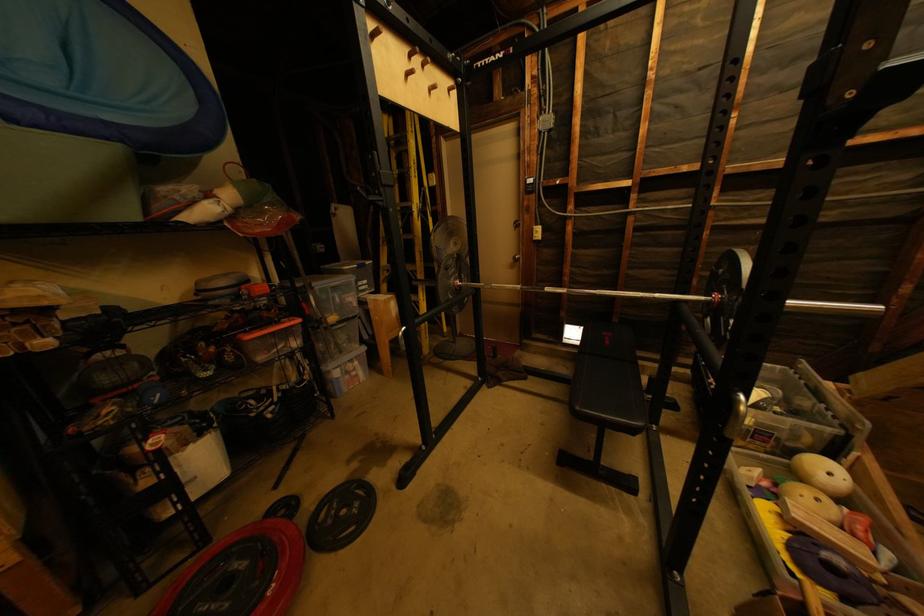
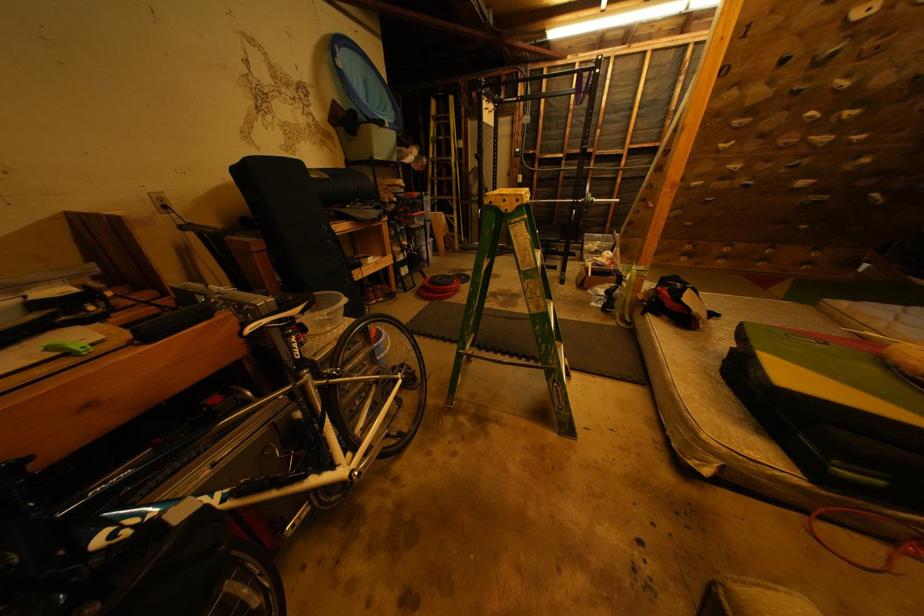
What movement of the cameraman would produce the second image?

The cameraman walked toward left, backward.